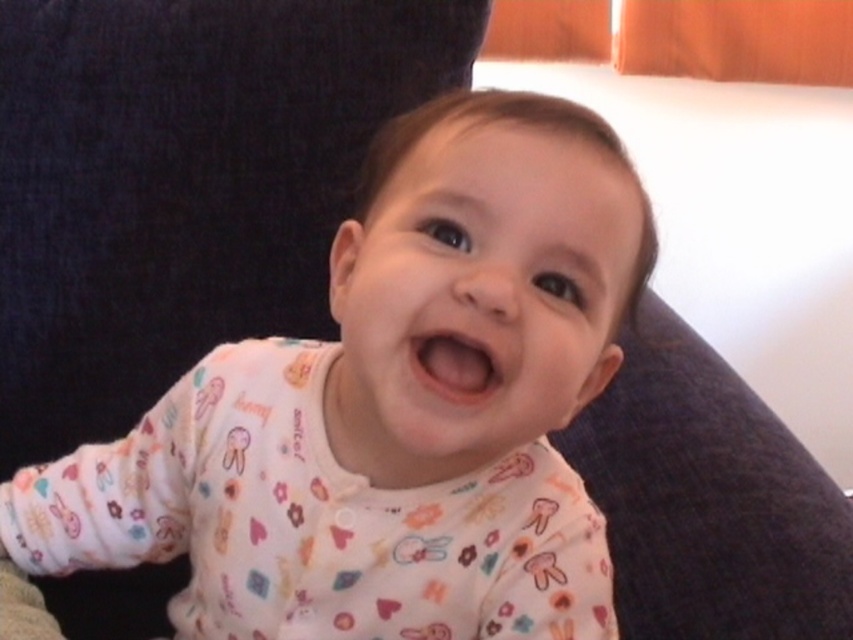
Is white soft fabric baby at center behind pink smooth mouth at center?

No, white soft fabric baby at center is closer to the viewer.

Between white soft fabric baby at center and pink smooth mouth at center, which one has more height?

white soft fabric baby at center is taller.

Measure the distance between point [309,433] and camera.

Point [309,433] and camera are 24.53 inches apart.

I want to click on white soft fabric baby at center, so click(x=389, y=410).